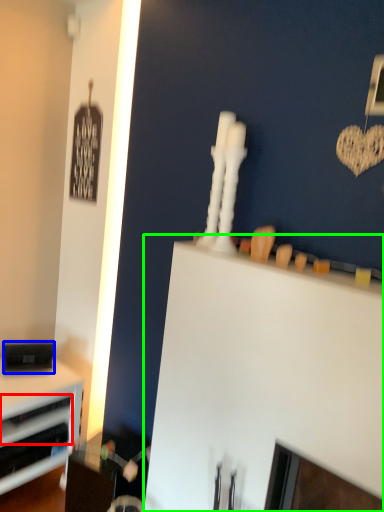
Question: Which object is positioned closest to drawer (highlighted by a red box)? Select from appliance (highlighted by a blue box) and computer desk (highlighted by a green box).

Choices:
 (A) appliance
 (B) computer desk

Answer: (A)